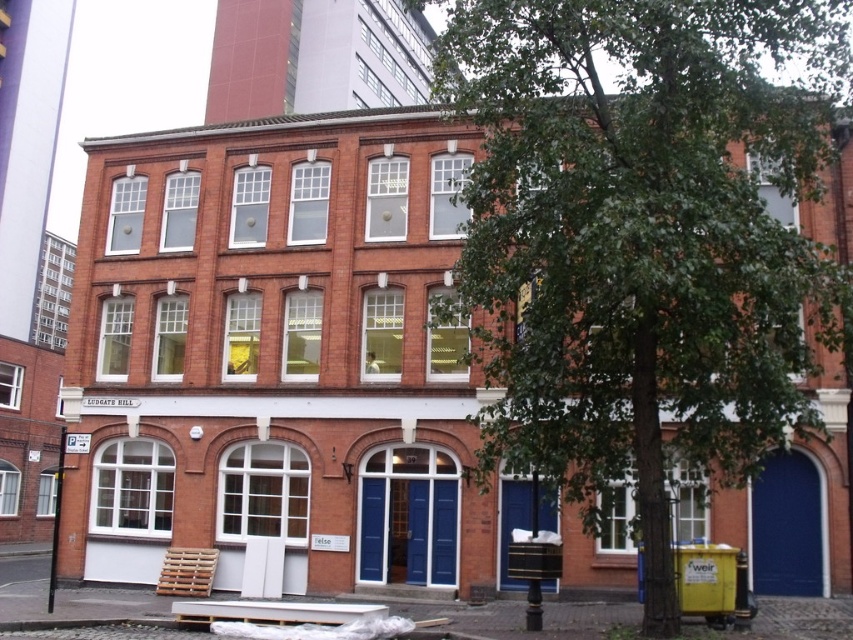
Which is behind, point (473, 192) or point (233, 612)?

Point (233, 612)

Identify the location of green leafy tree at center. Image resolution: width=853 pixels, height=640 pixels. (643, 237).

Based on the photo, which of these two, metallic silver bench at lower center or wooden pallet at lower left, stands taller?

With more height is wooden pallet at lower left.

Is point (370, 611) positioned in front of point (207, 564)?

Yes, point (370, 611) is closer to viewer.

At what (x,y) coordinates should I click in order to perform the action: click on metallic silver bench at lower center. Please return your answer as a coordinate pair (x, y). Image resolution: width=853 pixels, height=640 pixels. Looking at the image, I should click on (274, 611).

Who is lower down, green leafy tree at center or wooden pallet at lower left?

Positioned lower is wooden pallet at lower left.

Is point (706, 83) positioned before point (189, 579)?

Yes, it is.

Locate an element on the screen. This screenshot has width=853, height=640. green leafy tree at center is located at coordinates (643, 237).

Where is `green leafy tree at center`? The image size is (853, 640). green leafy tree at center is located at coordinates (643, 237).